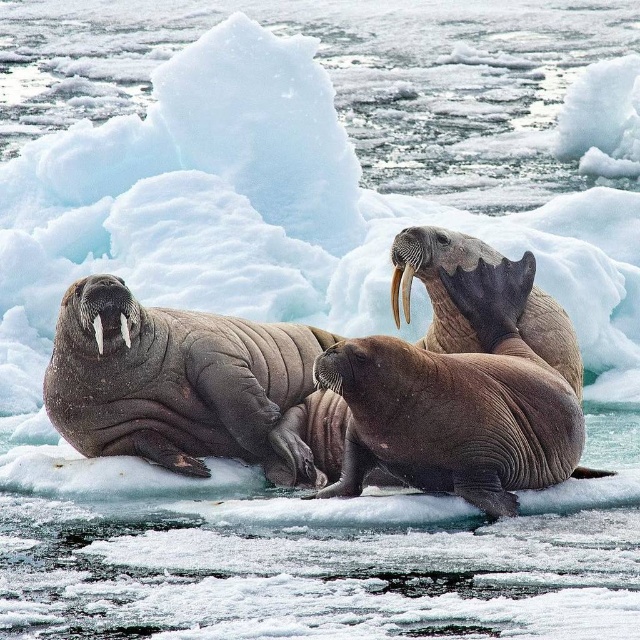
Between smooth brown walrus at center and grayish-brown tusk at left, which one has less height?

Standing shorter between the two is grayish-brown tusk at left.

From the picture: Is smooth brown walrus at center smaller than grayish-brown tusk at left?

Actually, smooth brown walrus at center might be larger than grayish-brown tusk at left.

Image resolution: width=640 pixels, height=640 pixels. I want to click on smooth brown walrus at center, so click(x=442, y=280).

You are a GUI agent. You are given a task and a screenshot of the screen. Output one action in this format:
    pyautogui.click(x=<x>, y=<y>)
    Task: Click on the smooth brown walrus at center
    This screenshot has height=640, width=640.
    Given the screenshot: What is the action you would take?
    pyautogui.click(x=442, y=280)

In the scene shown: Who is positioned more to the right, brown wrinkled walrus at center or smooth brown walrus at center?

smooth brown walrus at center

Is point (502, 304) positioned in front of point (544, 301)?

Yes, it is.

The image size is (640, 640). Find the location of `brown wrinkled walrus at center`. brown wrinkled walrus at center is located at coordinates (465, 381).

Who is more forward, (410, 304) or (128, 336)?

Point (128, 336) is in front.

Who is more forward, (403, 300) or (120, 326)?

Point (120, 326)

Where is `white ivory tusk at center`? This screenshot has height=640, width=640. white ivory tusk at center is located at coordinates (406, 289).